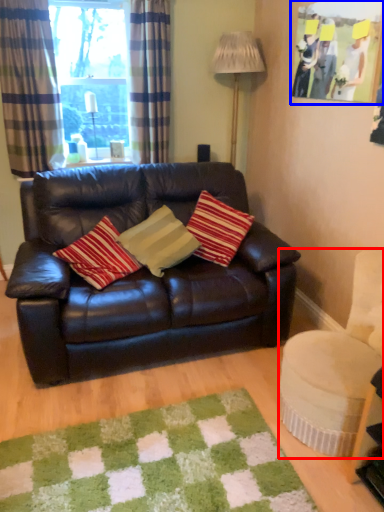
Question: Which object appears farthest to the camera in this image, swivel chair (highlighted by a red box) or picture frame (highlighted by a blue box)?

Choices:
 (A) swivel chair
 (B) picture frame

Answer: (B)